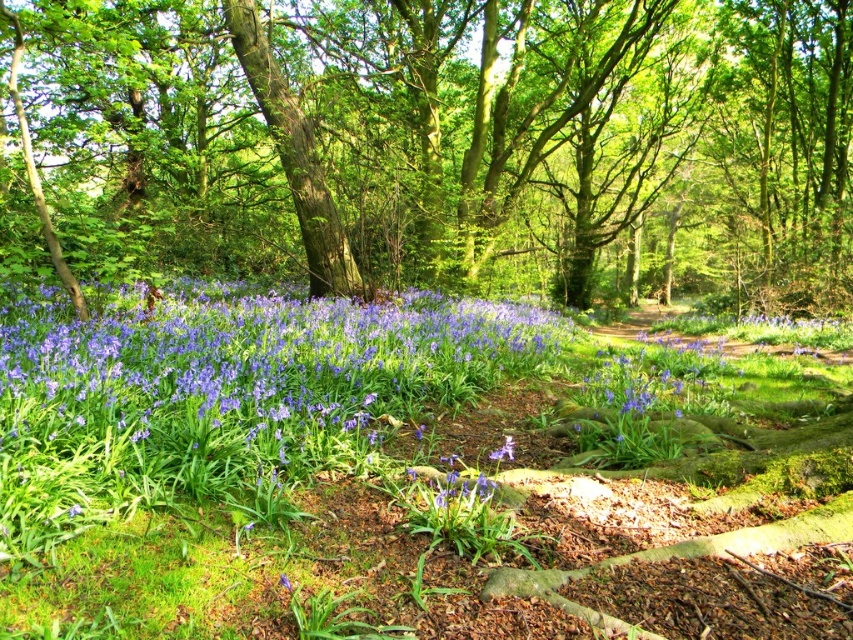
You are a botanist examining two flowers in a woodland scene. You have the purple glossy flowers at lower left and the blue matte flower at center. Which flower has a larger size?

The purple glossy flowers at lower left is bigger than the blue matte flower at center.